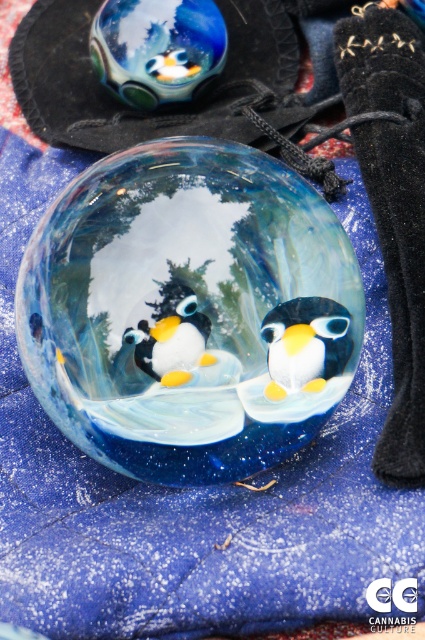
You are arranging a winter display and need to place the transparent glass bowl at center on top of the shiny glass penguin at center. Is this possible based on their current positions?

The transparent glass bowl at center is already located above the shiny glass penguin at center, so placing it on top would be possible as they are already positioned in that manner.

You are trying to place a small decorative item that is 10 cm wide on the table where the transparent glass bowl at center and the matte glass penguin at center are located. Based on their sizes, which object can the item fit next to without overlapping?

The transparent glass bowl at center is wider than the matte glass penguin at center. Since the item is 10 cm wide, it can fit next to either object, but it would have more space beside the matte glass penguin at center due to its smaller width.